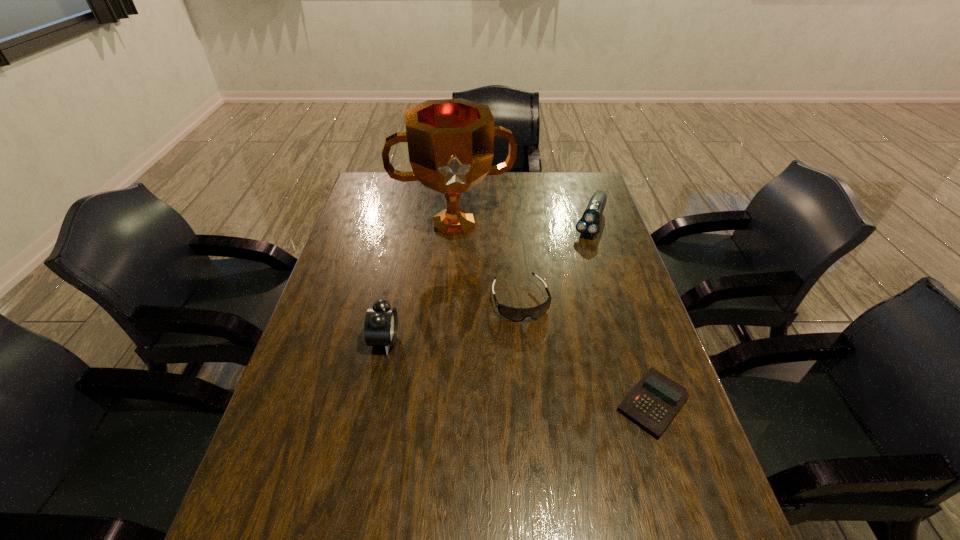
Where is `award that is positioned at the far edge`? award that is positioned at the far edge is located at coordinates (450, 142).

At what (x,y) coordinates should I click in order to perform the action: click on object located in the left edge section of the desktop. Please return your answer as a coordinate pair (x, y). This screenshot has height=540, width=960. Looking at the image, I should click on (450, 142).

In order to click on calculator located in the right edge section of the desktop in this screenshot , I will do `click(654, 401)`.

Where is `electric shaver present at the right edge`? This screenshot has height=540, width=960. electric shaver present at the right edge is located at coordinates (588, 225).

Find the location of a particular element. object present at the far left corner is located at coordinates (450, 142).

Locate an element on the screen. This screenshot has width=960, height=540. object that is at the far right corner is located at coordinates (588, 225).

The image size is (960, 540). Find the location of `free space at the far edge of the desktop`. free space at the far edge of the desktop is located at coordinates (536, 179).

Where is `vacant space at the near edge of the desktop`? The width and height of the screenshot is (960, 540). vacant space at the near edge of the desktop is located at coordinates (593, 505).

Locate an element on the screen. The height and width of the screenshot is (540, 960). vacant space at the left edge of the desktop is located at coordinates (356, 211).

Where is `vacant space at the right edge of the desktop`? Image resolution: width=960 pixels, height=540 pixels. vacant space at the right edge of the desktop is located at coordinates click(617, 266).